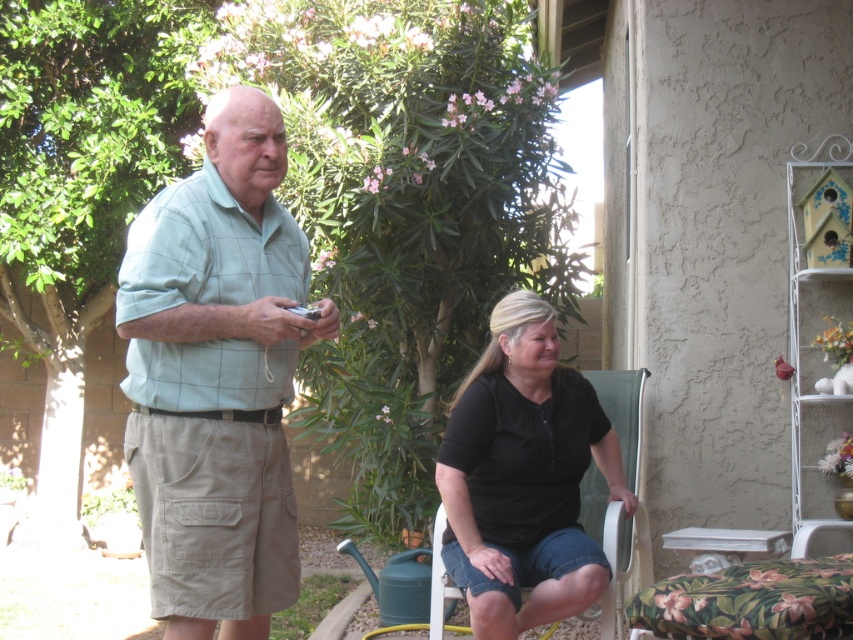
What do you see at coordinates (218, 376) in the screenshot? The height and width of the screenshot is (640, 853). I see `green plaid shirt at center` at bounding box center [218, 376].

Is green plaid shirt at center to the right of black cotton shirt at center from the viewer's perspective?

Incorrect, green plaid shirt at center is not on the right side of black cotton shirt at center.

Identify the location of green plaid shirt at center. This screenshot has width=853, height=640. (218, 376).